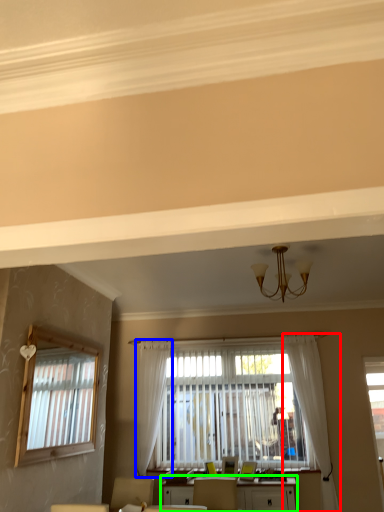
Question: Which object is positioned farthest from curtain (highlighted by a red box)? Select from curtain (highlighted by a blue box) and table (highlighted by a green box).

Choices:
 (A) curtain
 (B) table

Answer: (A)